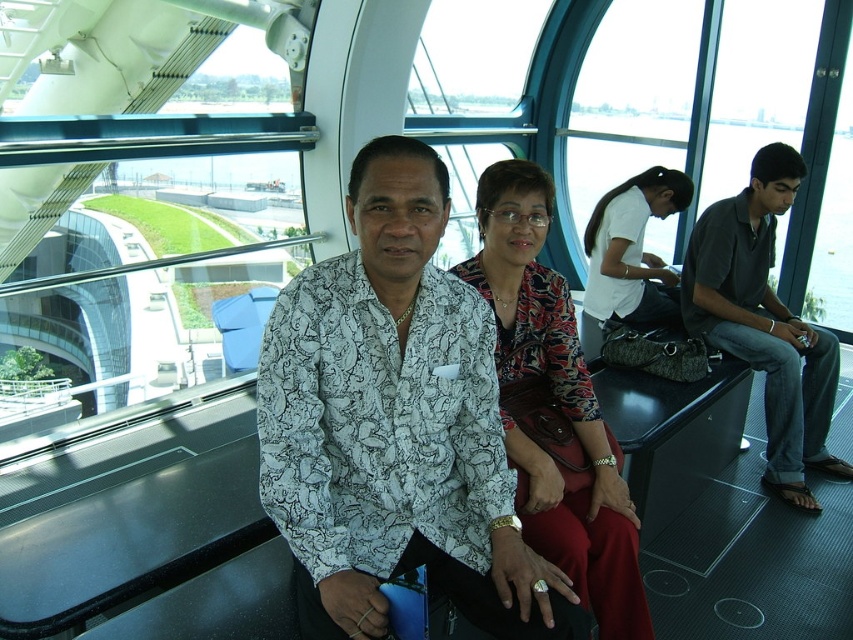
Question: Is printed fabric blouse at center in front of white matte shirt at center?

Choices:
 (A) no
 (B) yes

Answer: (B)

Question: Which point is closer to the camera?

Choices:
 (A) (700, 296)
 (B) (643, 202)

Answer: (A)

Question: Does printed fabric blouse at center have a greater width compared to white matte shirt at center?

Choices:
 (A) no
 (B) yes

Answer: (A)

Question: Which point is farther to the camera?

Choices:
 (A) (515, 170)
 (B) (323, 497)
 (C) (677, 308)

Answer: (C)

Question: Estimate the real-world distances between objects in this image. Which object is closer to the printed fabric shirt at center?

Choices:
 (A) dark gray shirt at right
 (B) printed fabric blouse at center

Answer: (B)

Question: Does printed fabric shirt at center come behind dark gray shirt at right?

Choices:
 (A) no
 (B) yes

Answer: (A)